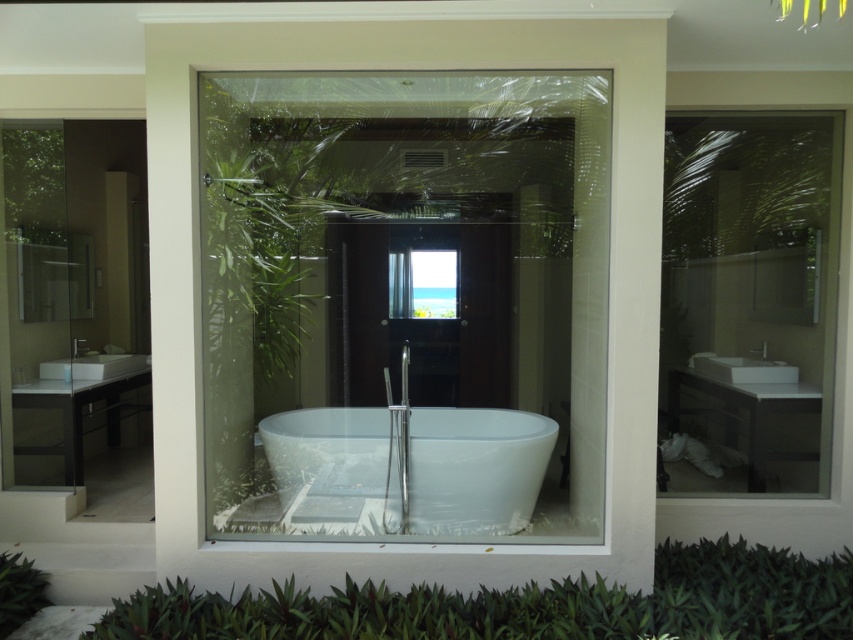
Question: Is transparent glass bathtub at center to the right of white glossy bathtub at center from the viewer's perspective?

Choices:
 (A) yes
 (B) no

Answer: (A)

Question: Which object is the farthest from the white glossy bathtub at center?

Choices:
 (A) transparent glass door at center
 (B) transparent glass bathtub at center

Answer: (A)

Question: Is transparent glass door at center positioned at the back of white ceramic sink at center?

Choices:
 (A) no
 (B) yes

Answer: (B)

Question: Can you confirm if transparent glass bathtub at center is bigger than white glossy bathtub at center?

Choices:
 (A) yes
 (B) no

Answer: (A)

Question: Which object appears closest to the camera in this image?

Choices:
 (A) white ceramic sink at center
 (B) transparent glass bathtub at center
 (C) white glossy bathtub at center
 (D) transparent glass door at center

Answer: (C)

Question: Which point is farther from the camera taking this photo?

Choices:
 (A) (463, 225)
 (B) (288, 428)
 (C) (235, 83)

Answer: (A)